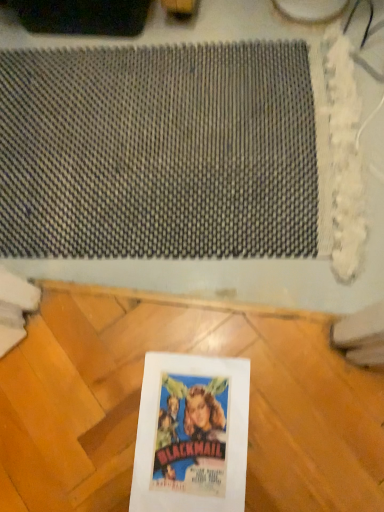
This screenshot has width=384, height=512. In order to click on free point above textured gray mat at upper center (from a real-world perspective) in this screenshot , I will do `click(170, 132)`.